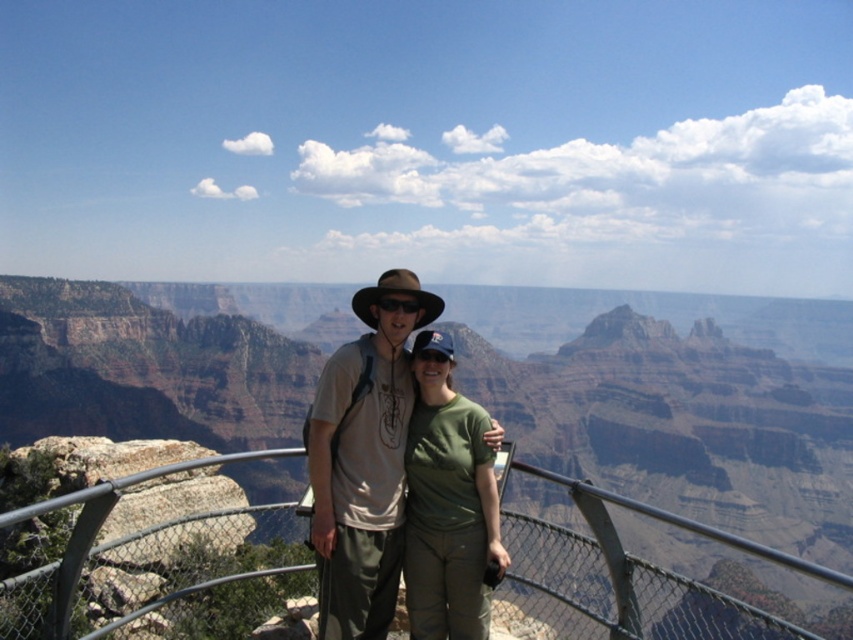
Question: Can you confirm if metallic gray railing at center is positioned below brown fabric cowboy hat at center?

Choices:
 (A) no
 (B) yes

Answer: (B)

Question: From the image, what is the correct spatial relationship of metallic gray railing at center in relation to green matte t-shirt at center?

Choices:
 (A) left
 (B) right

Answer: (B)

Question: Which of the following is the farthest from the observer?

Choices:
 (A) (431, 490)
 (B) (274, 598)

Answer: (B)

Question: Which object appears farthest from the camera in this image?

Choices:
 (A) green matte t-shirt at center
 (B) metallic gray railing at center

Answer: (A)

Question: Is the position of metallic gray railing at center more distant than that of brown fabric cowboy hat at center?

Choices:
 (A) yes
 (B) no

Answer: (B)

Question: Among these points, which one is nearest to the camera?

Choices:
 (A) (583, 625)
 (B) (433, 440)

Answer: (B)